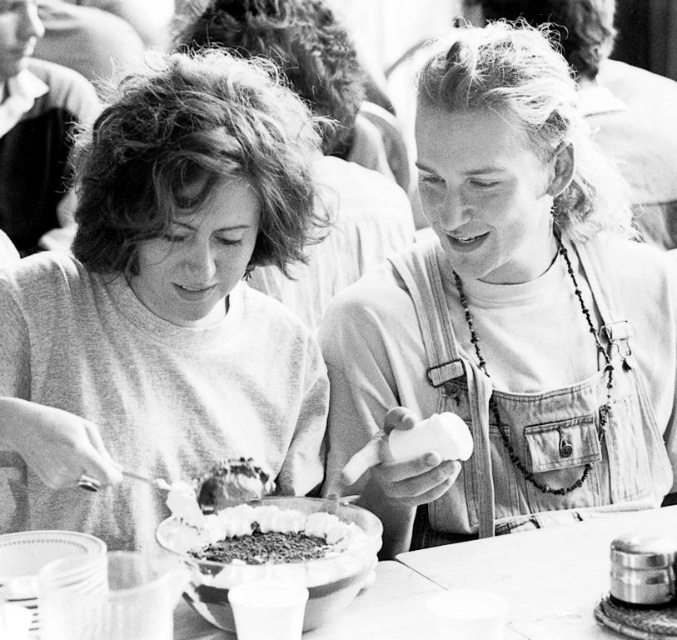
Question: Can you confirm if smooth gray shirt at center is positioned to the left of crumbly chocolate cake at center?

Choices:
 (A) no
 (B) yes

Answer: (B)

Question: Does smooth gray shirt at center appear under crumbly chocolate cake at center?

Choices:
 (A) no
 (B) yes

Answer: (A)

Question: Based on their relative distances, which object is farther from the crumbly chocolate cake at center?

Choices:
 (A) smooth wooden table at center
 (B) denim overalls at center

Answer: (B)

Question: Which is farther from the smooth wooden table at center?

Choices:
 (A) smooth gray shirt at center
 (B) crumbly chocolate cake at center
 (C) denim overalls at center

Answer: (A)

Question: Does smooth wooden table at center appear on the right side of crumbly chocolate cake at center?

Choices:
 (A) yes
 (B) no

Answer: (A)

Question: Which object is positioned closest to the smooth gray shirt at center?

Choices:
 (A) denim overalls at center
 (B) smooth wooden table at center

Answer: (A)